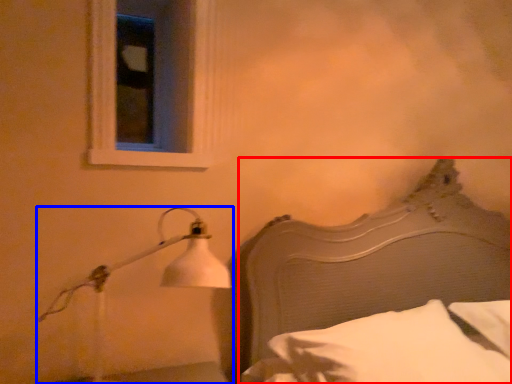
Question: Among these objects, which one is nearest to the camera, bed (highlighted by a red box) or lamp (highlighted by a blue box)?

Choices:
 (A) bed
 (B) lamp

Answer: (A)